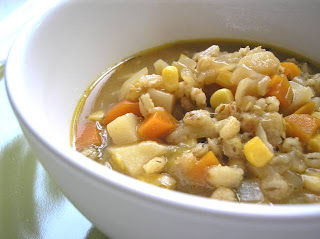
This screenshot has width=320, height=239. What are the coordinates of `empty space on left side of inside bowl` in the screenshot? It's located at (69, 35).